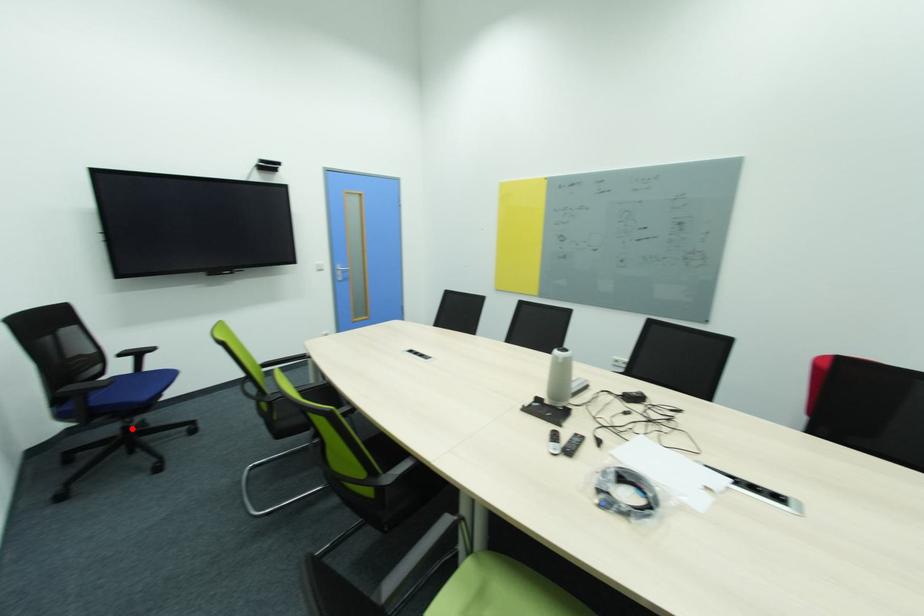
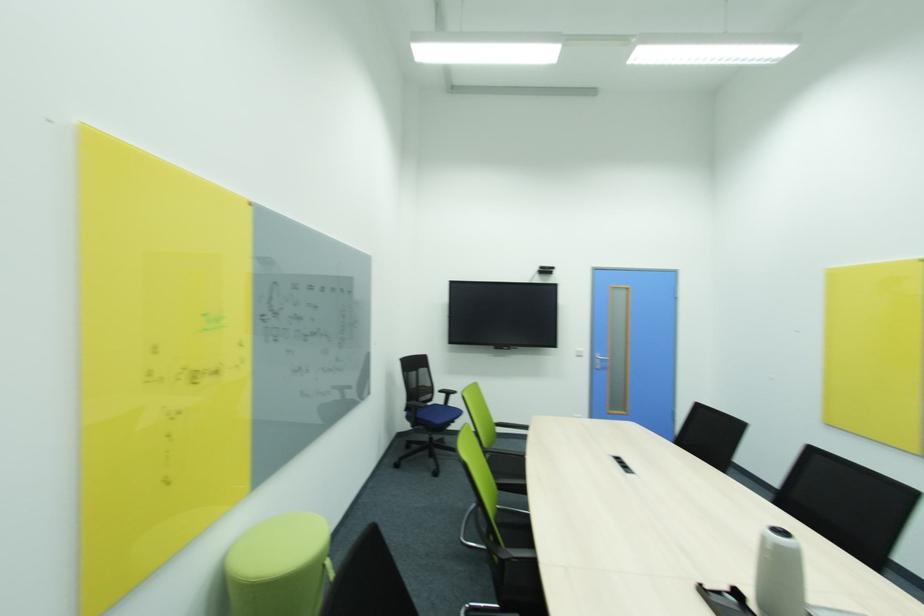
Locate, in the second image, the point that corresponds to the highlighted location in the first image.

(434, 440)